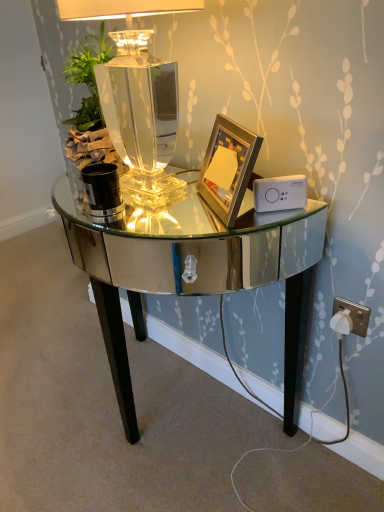
Find the location of a particular element. This screenshot has height=512, width=384. vacant location below clear glass lamp at center (from a real-world perspective) is located at coordinates (151, 190).